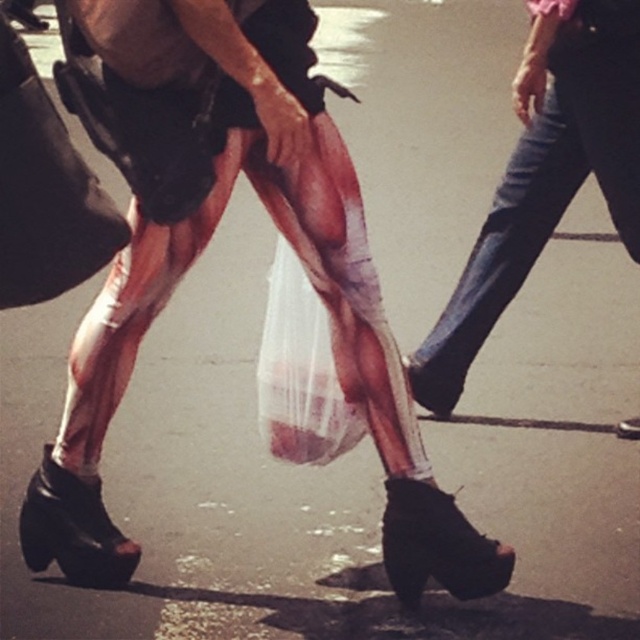
Which of these two, metallic silver tights at center or jeans at right, stands taller?

Standing taller between the two is metallic silver tights at center.

Does metallic silver tights at center appear on the right side of jeans at right?

No, metallic silver tights at center is not to the right of jeans at right.

Describe the element at coordinates (202, 252) in the screenshot. I see `metallic silver tights at center` at that location.

Locate an element on the screen. The height and width of the screenshot is (640, 640). metallic silver tights at center is located at coordinates (202, 252).